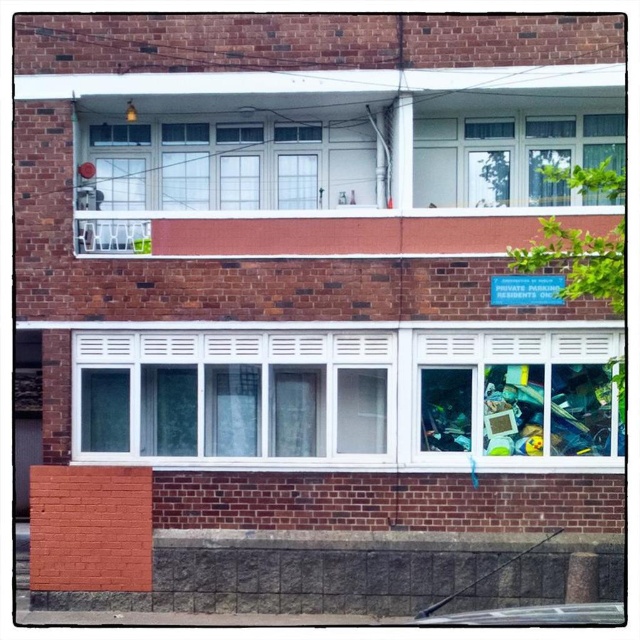
You are standing outside the two story brick building and looking at the windows on the lower level. You see a white plastic window at center and a transparent plastic window at center. Which window is closer to the ground?

The white plastic window at center is closer to the ground because it is located below the transparent plastic window at center.

You are standing outside the two story brick building and want to know what is at the coordinates point (x=230, y=394). What is located there?

At point (x=230, y=394) lies white plastic window at center.